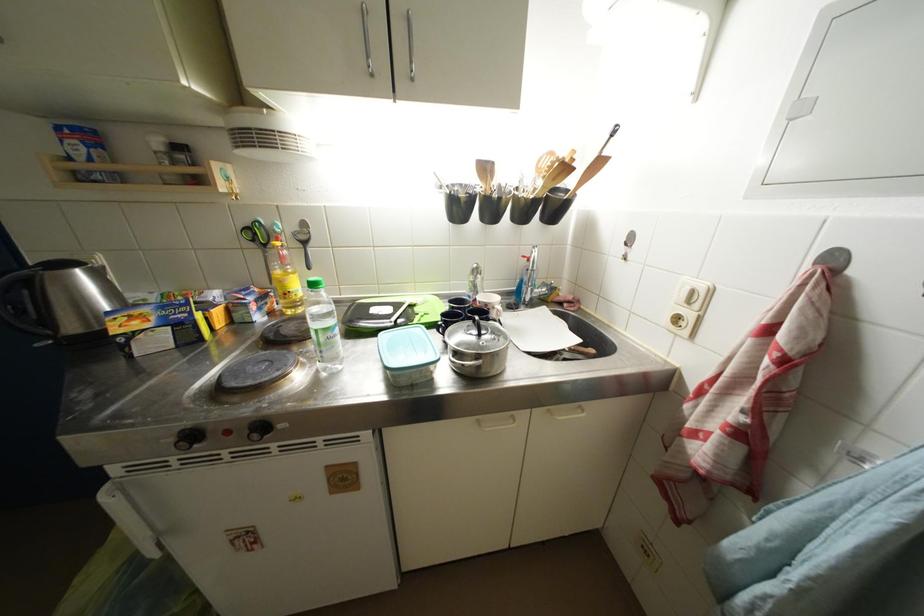
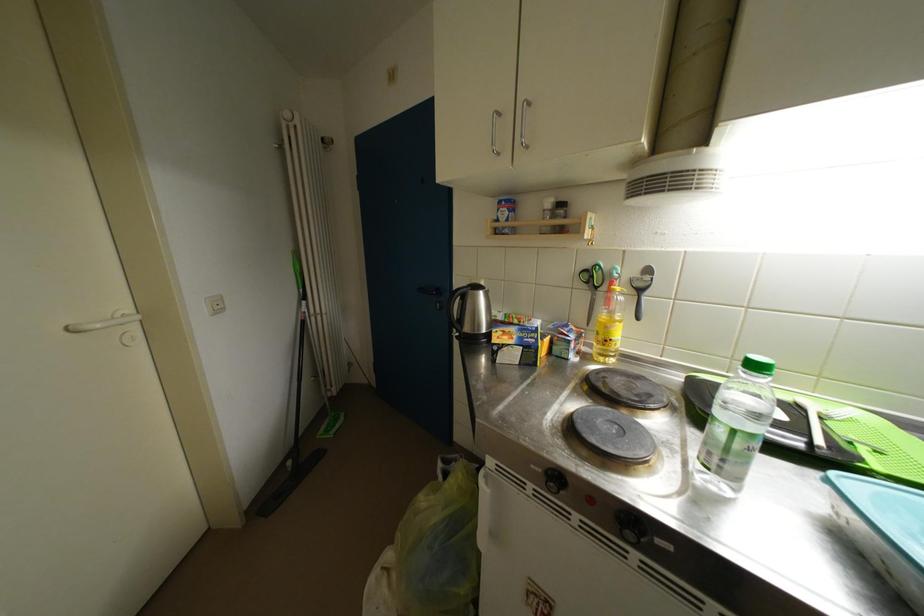
Question: How did the camera likely rotate?

Choices:
 (A) Left
 (B) Right
 (C) Up
 (D) Down

Answer: (A)